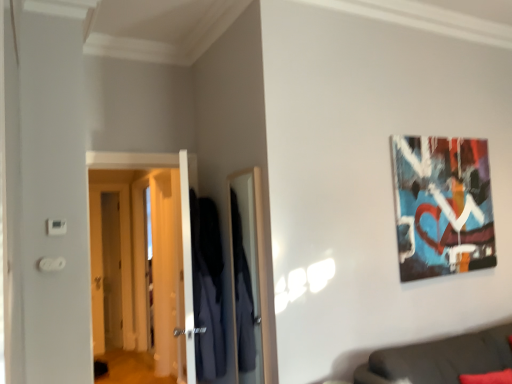
What are the coordinates of `abstract painting at upper right` in the screenshot? It's located at (442, 205).

Image resolution: width=512 pixels, height=384 pixels. What do you see at coordinates (442, 205) in the screenshot?
I see `abstract painting at upper right` at bounding box center [442, 205].

What do you see at coordinates (111, 266) in the screenshot?
I see `wooden door at left, which is the first door from left to right` at bounding box center [111, 266].

This screenshot has width=512, height=384. Find the location of `white glossy door at left, which appears as the 2th door when viewed from the left`. white glossy door at left, which appears as the 2th door when viewed from the left is located at coordinates (144, 255).

Does wooden door at left, the 2th door viewed from the front, contain dark blue fabric robe at center?

No, wooden door at left, the 2th door viewed from the front, does not contain dark blue fabric robe at center.

Is wooden door at left, marked as the first door in a back-to-front arrangement, smaller than dark blue fabric robe at center?

Yes, wooden door at left, marked as the first door in a back-to-front arrangement, is smaller than dark blue fabric robe at center.

Is point (112, 213) more distant than point (204, 323)?

Yes, point (112, 213) is behind point (204, 323).

From the image's perspective, is wooden door at left, which is the first door from left to right, on top of dark blue fabric robe at center?

Incorrect, from the image's perspective, wooden door at left, which is the first door from left to right, is lower than dark blue fabric robe at center.

Can you confirm if dark blue fabric robe at center is shorter than abstract painting at upper right?

In fact, dark blue fabric robe at center may be taller than abstract painting at upper right.

Based on their positions, is dark blue fabric robe at center located to the left or right of abstract painting at upper right?

From the image, it's evident that dark blue fabric robe at center is to the left of abstract painting at upper right.

Consider the image. Is dark blue fabric robe at center surrounding abstract painting at upper right?

That's incorrect, abstract painting at upper right is not inside dark blue fabric robe at center.

In the scene shown: Considering their positions, is abstract painting at upper right located in front of or behind dark gray fabric couch at lower right?

abstract painting at upper right is behind dark gray fabric couch at lower right.

This screenshot has width=512, height=384. In the image, there is a dark gray fabric couch at lower right. In order to click on picture frame above it (from the image's perspective) in this screenshot , I will do tap(442, 205).

Does point (454, 208) lie in front of point (431, 361)?

No, (454, 208) is further to viewer.

Does abstract painting at upper right turn towards dark gray fabric couch at lower right?

No, abstract painting at upper right is not turned towards dark gray fabric couch at lower right.

Is wooden door at left, marked as the first door in a back-to-front arrangement, closer to the viewer compared to dark gray fabric couch at lower right?

No, it is behind dark gray fabric couch at lower right.

Is wooden door at left, marked as the first door in a back-to-front arrangement, not within dark gray fabric couch at lower right?

Yes, wooden door at left, marked as the first door in a back-to-front arrangement, is located beyond the bounds of dark gray fabric couch at lower right.

Between wooden door at left, which is the first door from left to right, and dark gray fabric couch at lower right, which one has larger width?

With larger width is dark gray fabric couch at lower right.

Could you tell me if wooden door at left, the 2th door when ordered from right to left, is facing dark gray fabric couch at lower right?

No.

From the image's perspective, would you say dark gray fabric couch at lower right is positioned over wooden door at left, which is the first door from left to right?

Actually, dark gray fabric couch at lower right appears below wooden door at left, which is the first door from left to right, in the image.

From a real-world perspective, is dark gray fabric couch at lower right above or below wooden door at left, marked as the first door in a back-to-front arrangement?

Clearly, from a real-world perspective, dark gray fabric couch at lower right is below wooden door at left, marked as the first door in a back-to-front arrangement.

From the picture: Is dark gray fabric couch at lower right closer to the viewer compared to wooden door at left, the 2th door viewed from the front?

Yes, dark gray fabric couch at lower right is closer to the camera.

Are white glossy door at left, which appears as the 2th door when viewed from the left, and wooden door at left, marked as the first door in a back-to-front arrangement, located far from each other?

No.

Is point (96, 220) positioned after point (104, 283)?

That is True.

Which object is positioned more to the left, white glossy door at left, which appears as the 2th door when viewed from the left, or wooden door at left, marked as the first door in a back-to-front arrangement?

Positioned to the left is wooden door at left, marked as the first door in a back-to-front arrangement.

Which is behind, wooden door at left, which is the first door from left to right, or white glossy door at left, which appears as the second door when viewed from the back?

wooden door at left, which is the first door from left to right, is more distant.

In the scene shown: Who is taller, wooden door at left, the 2th door viewed from the front, or white glossy door at left, which appears as the 2th door when viewed from the left?

With more height is wooden door at left, the 2th door viewed from the front.

How distant is wooden door at left, marked as the first door in a back-to-front arrangement, from white glossy door at left, which appears as the 2th door when viewed from the left?

wooden door at left, marked as the first door in a back-to-front arrangement, is 17.94 inches away from white glossy door at left, which appears as the 2th door when viewed from the left.

Is wooden door at left, the 2th door when ordered from right to left, facing away from white glossy door at left, which is counted as the 1th door, starting from the front?

No.

Find the location of `robe that appears in front of the wooden door at left, the 2th door viewed from the front`. robe that appears in front of the wooden door at left, the 2th door viewed from the front is located at coordinates (207, 287).

Where is `picture frame on the right of dark blue fabric robe at center`? picture frame on the right of dark blue fabric robe at center is located at coordinates (442, 205).

Which object lies further to the anchor point abstract painting at upper right, wooden door at left, the 2th door viewed from the front, or white glossy door at left, which is counted as the 1th door, starting from the front?

wooden door at left, the 2th door viewed from the front, lies further to abstract painting at upper right than the other object.

When comparing their distances from dark gray fabric couch at lower right, does dark blue fabric robe at center or abstract painting at upper right seem further?

dark blue fabric robe at center.

Considering their positions, is wooden door at left, the 2th door when ordered from right to left, positioned further to dark gray fabric couch at lower right than abstract painting at upper right?

Based on the image, wooden door at left, the 2th door when ordered from right to left, appears to be further to dark gray fabric couch at lower right.

Considering their positions, is wooden door at left, the 2th door viewed from the front, positioned closer to abstract painting at upper right than dark blue fabric robe at center?

The object closer to abstract painting at upper right is dark blue fabric robe at center.

Estimate the real-world distances between objects in this image. Which object is further from white glossy door at left, which is counted as the 1th door, starting from the front, abstract painting at upper right or dark blue fabric robe at center?

The object further to white glossy door at left, which is counted as the 1th door, starting from the front, is abstract painting at upper right.

From the image, which object appears to be farther from wooden door at left, which is the first door from left to right, dark gray fabric couch at lower right or dark blue fabric robe at center?

dark gray fabric couch at lower right is further to wooden door at left, which is the first door from left to right.

Looking at this image, looking at the image, which one is located further to white glossy door at left, which is counted as the 1th door, starting from the front, abstract painting at upper right or wooden door at left, which is the first door from left to right?

abstract painting at upper right is further to white glossy door at left, which is counted as the 1th door, starting from the front.

When comparing their distances from wooden door at left, which is the first door from left to right, does white glossy door at left, positioned as the 1th door in right-to-left order, or abstract painting at upper right seem closer?

Among the two, white glossy door at left, positioned as the 1th door in right-to-left order, is located nearer to wooden door at left, which is the first door from left to right.

Identify the location of door between dark gray fabric couch at lower right and wooden door at left, which is the first door from left to right, along the z-axis. This screenshot has width=512, height=384. (144, 255).

Identify the location of door between wooden door at left, the 2th door when ordered from right to left, and abstract painting at upper right from left to right. Image resolution: width=512 pixels, height=384 pixels. (144, 255).

Locate an element on the screen. The height and width of the screenshot is (384, 512). picture frame located between dark blue fabric robe at center and dark gray fabric couch at lower right in the left-right direction is located at coordinates (442, 205).

The image size is (512, 384). In order to click on picture frame situated between white glossy door at left, which is counted as the 1th door, starting from the front, and dark gray fabric couch at lower right from left to right in this screenshot , I will do `click(442, 205)`.